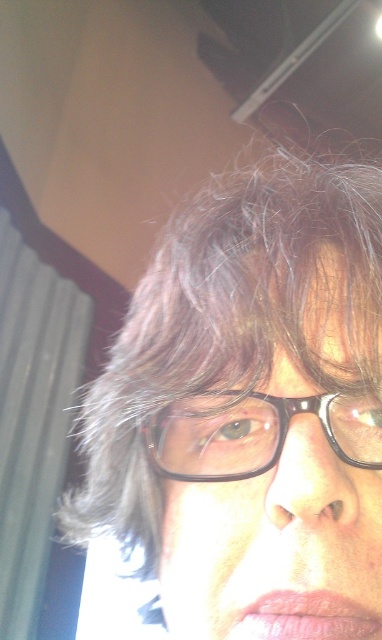
Question: Among these points, which one is farthest from the camera?

Choices:
 (A) (330, 531)
 (B) (246, 448)

Answer: (B)

Question: Can you confirm if brown matte hair at center is thinner than black plastic glasses at center?

Choices:
 (A) yes
 (B) no

Answer: (B)

Question: Which object appears farthest from the camera in this image?

Choices:
 (A) brown matte hair at center
 (B) black plastic glasses at center

Answer: (B)

Question: Does brown matte hair at center appear on the right side of black plastic glasses at center?

Choices:
 (A) yes
 (B) no

Answer: (A)

Question: From the image, what is the correct spatial relationship of brown matte hair at center in relation to black plastic glasses at center?

Choices:
 (A) below
 (B) above

Answer: (B)